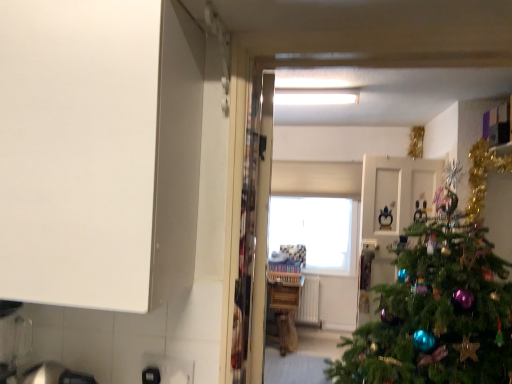
The width and height of the screenshot is (512, 384). Find the location of `green matte christmas tree at right`. green matte christmas tree at right is located at coordinates (440, 302).

The height and width of the screenshot is (384, 512). Describe the element at coordinates (394, 203) in the screenshot. I see `white glossy door at center` at that location.

This screenshot has height=384, width=512. What are the coordinates of `transparent glass window at center` in the screenshot? It's located at (317, 231).

Consider the image. Is wooden counter at center at the back of transparent glass window at center?

No, transparent glass window at center's orientation is not away from wooden counter at center.

Can you confirm if transparent glass window at center is smaller than wooden counter at center?

Indeed, transparent glass window at center has a smaller size compared to wooden counter at center.

From a real-world perspective, is transparent glass window at center above or below wooden counter at center?

From a real-world perspective, transparent glass window at center is physically above wooden counter at center.

Is transparent glass window at center in front of or behind wooden counter at center in the image?

transparent glass window at center is behind wooden counter at center.

Which object is wider, wooden counter at center or transparent glass window at center?

wooden counter at center is wider.

You are a GUI agent. You are given a task and a screenshot of the screen. Output one action in this format:
    pyautogui.click(x=<x>, y=<y>)
    Task: Click on the counter in front of the transparent glass window at center
    
    Given the screenshot: What is the action you would take?
    pyautogui.click(x=285, y=308)

Does wooden counter at center contain transparent glass window at center?

No, transparent glass window at center is not surrounded by wooden counter at center.

From the image's perspective, is wooden counter at center located beneath transparent glass window at center?

Yes.

Between wooden counter at center and green matte christmas tree at right, which one appears on the left side from the viewer's perspective?

wooden counter at center is more to the left.

Based on their sizes in the image, would you say wooden counter at center is bigger or smaller than green matte christmas tree at right?

Considering their sizes, wooden counter at center takes up less space than green matte christmas tree at right.

How different are the orientations of wooden counter at center and green matte christmas tree at right in degrees?

The facing directions of wooden counter at center and green matte christmas tree at right are 0.434 degrees apart.

Based on the photo, measure the distance between wooden counter at center and green matte christmas tree at right.

They are 5.79 feet apart.

Which is farther from the camera, (x=428, y=290) or (x=279, y=299)?

Point (x=279, y=299)

From the image's perspective, which is above, green matte christmas tree at right or wooden counter at center?

green matte christmas tree at right appears higher in the image.

Does green matte christmas tree at right appear on the left side of wooden counter at center?

No.

From the image's perspective, is green matte christmas tree at right positioned above or below transparent glass window at center?

green matte christmas tree at right is situated higher than transparent glass window at center in the image.

Which object is wider, green matte christmas tree at right or transparent glass window at center?

green matte christmas tree at right.

Who is taller, green matte christmas tree at right or transparent glass window at center?

green matte christmas tree at right is taller.

Is green matte christmas tree at right facing towards transparent glass window at center?

No, green matte christmas tree at right is not oriented towards transparent glass window at center.

From the image's perspective, is white glossy door at center above or below green matte christmas tree at right?

Clearly, from the image's perspective, white glossy door at center is below green matte christmas tree at right.

Considering the relative sizes of white glossy door at center and green matte christmas tree at right in the image provided, is white glossy door at center thinner than green matte christmas tree at right?

Indeed, white glossy door at center has a lesser width compared to green matte christmas tree at right.

Is white glossy door at center inside or outside of green matte christmas tree at right?

white glossy door at center lies outside green matte christmas tree at right.

Between point (372, 297) and point (371, 328), which one is positioned in front?

The point (371, 328) is in front.

Considering the relative sizes of white glossy door at center and transparent glass window at center in the image provided, is white glossy door at center shorter than transparent glass window at center?

Incorrect, the height of white glossy door at center does not fall short of that of transparent glass window at center.

Is white glossy door at center to the right of transparent glass window at center from the viewer's perspective?

Yes, white glossy door at center is to the right of transparent glass window at center.

Considering the positions of point (387, 268) and point (275, 202), is point (387, 268) closer or farther from the camera than point (275, 202)?

Point (387, 268).

Between white glossy door at center and transparent glass window at center, which one has smaller width?

Thinner between the two is transparent glass window at center.

Image resolution: width=512 pixels, height=384 pixels. I want to click on counter below the transparent glass window at center (from the image's perspective), so click(x=285, y=308).

You are a GUI agent. You are given a task and a screenshot of the screen. Output one action in this format:
    pyautogui.click(x=<x>, y=<y>)
    Task: Click on the counter on the left of transparent glass window at center
    This screenshot has height=384, width=512.
    Given the screenshot: What is the action you would take?
    pyautogui.click(x=285, y=308)

When comparing their distances from wooden counter at center, does green matte christmas tree at right or white glossy door at center seem closer?

Based on the image, white glossy door at center appears to be nearer to wooden counter at center.

Which object lies nearer to the anchor point transparent glass window at center, white glossy door at center or wooden counter at center?

Among the two, wooden counter at center is located nearer to transparent glass window at center.

Estimate the real-world distances between objects in this image. Which object is further from transparent glass window at center, wooden counter at center or green matte christmas tree at right?

green matte christmas tree at right is further to transparent glass window at center.

Which object lies nearer to the anchor point white glossy door at center, wooden counter at center or transparent glass window at center?

wooden counter at center is positioned closer to the anchor white glossy door at center.

Which object lies further to the anchor point green matte christmas tree at right, wooden counter at center or transparent glass window at center?

Based on the image, transparent glass window at center appears to be further to green matte christmas tree at right.

Estimate the real-world distances between objects in this image. Which object is closer to white glossy door at center, green matte christmas tree at right or wooden counter at center?

green matte christmas tree at right is closer to white glossy door at center.

When comparing their distances from transparent glass window at center, does white glossy door at center or green matte christmas tree at right seem further?

green matte christmas tree at right.

From the image, which object appears to be nearer to wooden counter at center, white glossy door at center or green matte christmas tree at right?

white glossy door at center.

Where is `window located between wooden counter at center and white glossy door at center in the left-right direction`? window located between wooden counter at center and white glossy door at center in the left-right direction is located at coordinates (317, 231).

You are a GUI agent. You are given a task and a screenshot of the screen. Output one action in this format:
    pyautogui.click(x=<x>, y=<y>)
    Task: Click on the counter between green matte christmas tree at right and transparent glass window at center in the front-back direction
    The width and height of the screenshot is (512, 384).
    Given the screenshot: What is the action you would take?
    pyautogui.click(x=285, y=308)

The image size is (512, 384). Identify the location of window positioned between green matte christmas tree at right and white glossy door at center from near to far. (317, 231).

Locate an element on the screen. counter between green matte christmas tree at right and white glossy door at center from front to back is located at coordinates [285, 308].